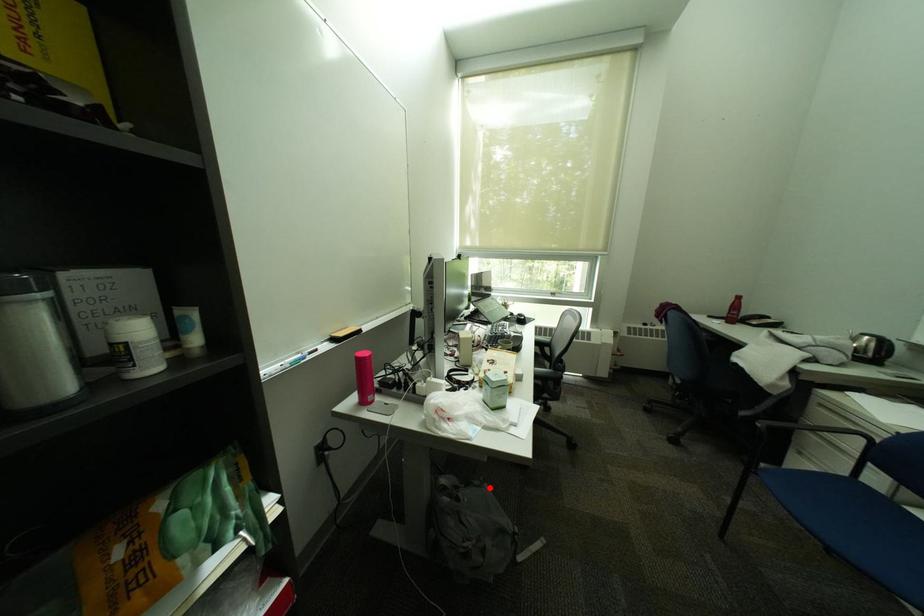
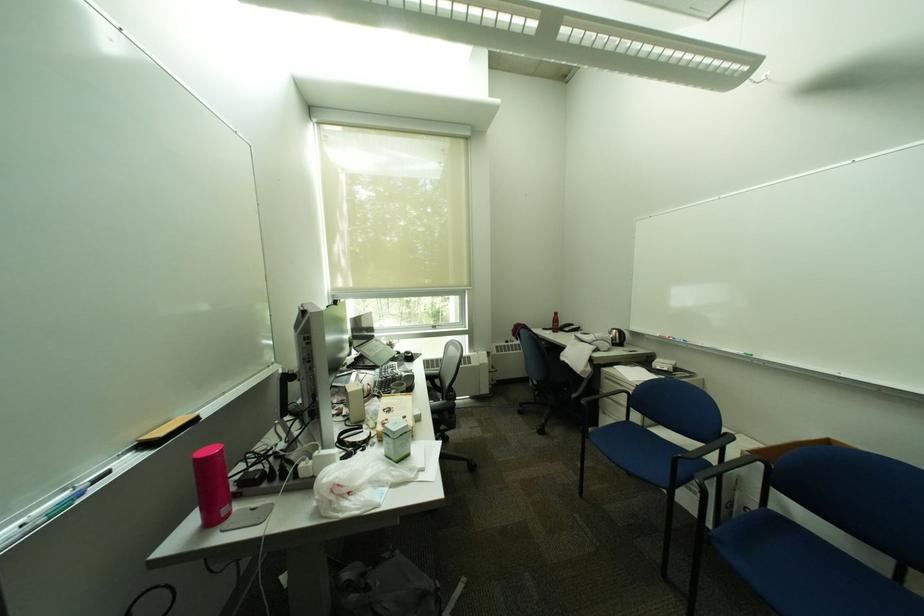
Question: I am providing you with two images of the same scene from different viewpoints. Image1 has a red point marked. In image2, the corresponding 3D location appears at what relative position? Reply with the corresponding letter.

Choices:
 (A) Closer
 (B) Farther

Answer: (A)